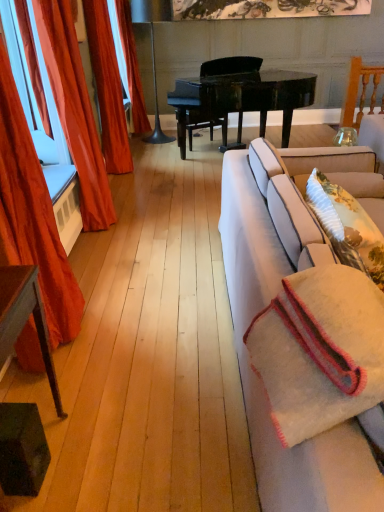
The height and width of the screenshot is (512, 384). What are the coordinates of `unoccupied space behind green painted wood side table at lower left` in the screenshot? It's located at (78, 390).